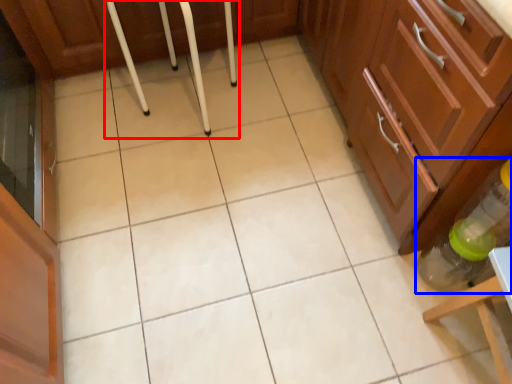
Question: Which object is further to the camera taking this photo, bar stool (highlighted by a red box) or bottle (highlighted by a blue box)?

Choices:
 (A) bar stool
 (B) bottle

Answer: (A)